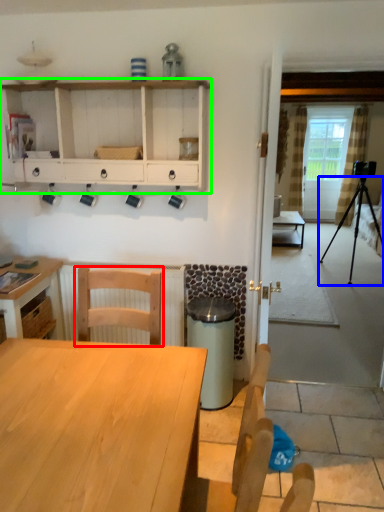
Question: Which object is the farthest from chair (highlighted by a red box)? Choose among these: tripod (highlighted by a blue box) or shelf (highlighted by a green box).

Choices:
 (A) tripod
 (B) shelf

Answer: (A)